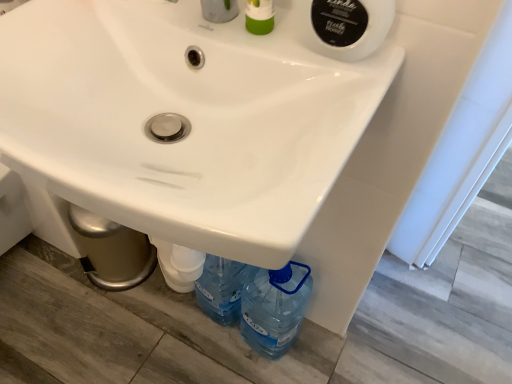
Describe the element at coordinates (259, 16) in the screenshot. I see `green plastic soap dispenser at upper center` at that location.

Find the location of a particular element. white glossy sink at center is located at coordinates (184, 119).

From a real-world perspective, which object stands above the other?

green plastic soap dispenser at upper center, from a real-world perspective.

Is white plastic pipe at lower center next to green plastic soap dispenser at upper center and touching it?

No, white plastic pipe at lower center is not with green plastic soap dispenser at upper center.

The height and width of the screenshot is (384, 512). Find the location of `bottle on the left of green plastic soap dispenser at upper center`. bottle on the left of green plastic soap dispenser at upper center is located at coordinates (179, 264).

Is point (169, 277) positioned after point (265, 9)?

Yes, point (169, 277) is farther from viewer.

From the image's perspective, is white plastic pipe at lower center above or below white glossy sink at center?

white plastic pipe at lower center is situated lower than white glossy sink at center in the image.

Is point (168, 245) closer or farther from the camera than point (333, 126)?

Point (168, 245).

Where is `bottle that appears below the white glossy sink at center (from a real-world perspective)`? Image resolution: width=512 pixels, height=384 pixels. bottle that appears below the white glossy sink at center (from a real-world perspective) is located at coordinates (179, 264).

Between white plastic pipe at lower center and white glossy sink at center, which one has larger width?

white glossy sink at center is wider.

Considering the relative sizes of white glossy sink at center and green plastic soap dispenser at upper center in the image provided, is white glossy sink at center wider than green plastic soap dispenser at upper center?

Correct, the width of white glossy sink at center exceeds that of green plastic soap dispenser at upper center.

Locate an element on the screen. The height and width of the screenshot is (384, 512). toiletry lying on the right of white glossy sink at center is located at coordinates (259, 16).

Does white glossy sink at center have a lesser height compared to white plastic pipe at lower center?

No, white glossy sink at center is not shorter than white plastic pipe at lower center.

From the image's perspective, is white glossy sink at center above white plastic pipe at lower center?

Yes, from the image's perspective, white glossy sink at center is on top of white plastic pipe at lower center.

From a real-world perspective, does white glossy sink at center sit lower than white plastic pipe at lower center?

No, from a real-world perspective, white glossy sink at center is not under white plastic pipe at lower center.

Is white plastic pipe at lower center at the back of green plastic soap dispenser at upper center?

No.

Considering their positions, is green plastic soap dispenser at upper center located in front of or behind white plastic pipe at lower center?

Visually, green plastic soap dispenser at upper center is located in front of white plastic pipe at lower center.

Is green plastic soap dispenser at upper center at the left side of white plastic pipe at lower center?

Incorrect, green plastic soap dispenser at upper center is not on the left side of white plastic pipe at lower center.

Where is `toiletry above the white plastic pipe at lower center (from the image's perspective)`? This screenshot has height=384, width=512. toiletry above the white plastic pipe at lower center (from the image's perspective) is located at coordinates (259, 16).

Would you consider green plastic soap dispenser at upper center to be distant from white glossy sink at center?

No, green plastic soap dispenser at upper center is in close proximity to white glossy sink at center.

Considering the sizes of green plastic soap dispenser at upper center and white glossy sink at center in the image, is green plastic soap dispenser at upper center taller or shorter than white glossy sink at center?

Considering their sizes, green plastic soap dispenser at upper center has more height than white glossy sink at center.

From the image's perspective, is green plastic soap dispenser at upper center over white glossy sink at center?

Yes, from the image's perspective, green plastic soap dispenser at upper center is over white glossy sink at center.

Which object is further away from the camera, green plastic soap dispenser at upper center or white glossy sink at center?

green plastic soap dispenser at upper center is more distant.

Identify the location of toiletry positioned vertically above the white plastic pipe at lower center (from a real-world perspective). The width and height of the screenshot is (512, 384). (259, 16).

Identify the location of sink in front of the white plastic pipe at lower center. The height and width of the screenshot is (384, 512). (184, 119).

Based on the photo, estimate the real-world distances between objects in this image. Which object is further from white plastic pipe at lower center, green plastic soap dispenser at upper center or white glossy sink at center?

The object further to white plastic pipe at lower center is green plastic soap dispenser at upper center.

Estimate the real-world distances between objects in this image. Which object is closer to green plastic soap dispenser at upper center, white glossy sink at center or white plastic pipe at lower center?

The object closer to green plastic soap dispenser at upper center is white glossy sink at center.

Estimate the real-world distances between objects in this image. Which object is closer to white plastic pipe at lower center, white glossy sink at center or green plastic soap dispenser at upper center?

Based on the image, white glossy sink at center appears to be nearer to white plastic pipe at lower center.

When comparing their distances from white glossy sink at center, does green plastic soap dispenser at upper center or white plastic pipe at lower center seem closer?

The object closer to white glossy sink at center is green plastic soap dispenser at upper center.

Looking at the image, which one is located further to white glossy sink at center, white plastic pipe at lower center or green plastic soap dispenser at upper center?

Based on the image, white plastic pipe at lower center appears to be further to white glossy sink at center.

When comparing their distances from green plastic soap dispenser at upper center, does white plastic pipe at lower center or white glossy sink at center seem closer?

white glossy sink at center is positioned closer to the anchor green plastic soap dispenser at upper center.

Where is `toiletry between white glossy sink at center and white plastic pipe at lower center from front to back`? The height and width of the screenshot is (384, 512). toiletry between white glossy sink at center and white plastic pipe at lower center from front to back is located at coordinates (259, 16).